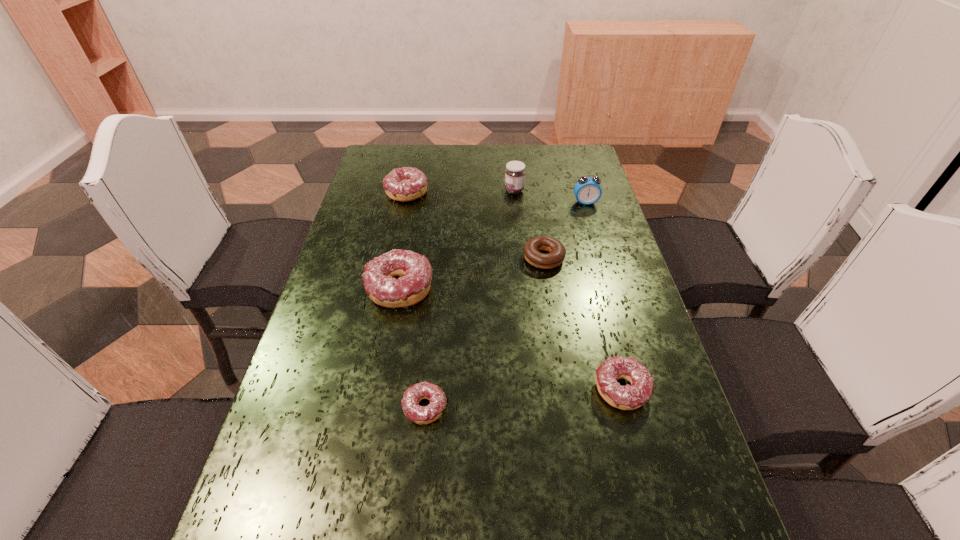
Locate which object ranks second in proximity to the jam. Please provide its 2D coordinates. Your answer should be formatted as a tuple, i.e. [(x, y)], where the tuple contains the x and y coordinates of a point satisfying the conditions above.

[(531, 249)]

Identify which doughnut is located as the third nearest to the brown doughnut. Please provide its 2D coordinates. Your answer should be formatted as a tuple, i.e. [(x, y)], where the tuple contains the x and y coordinates of a point satisfying the conditions above.

[(404, 184)]

I want to click on doughnut that is the fourth closest one to the fourth tallest object, so click(629, 397).

You are a GUI agent. You are given a task and a screenshot of the screen. Output one action in this format:
    pyautogui.click(x=<x>, y=<y>)
    Task: Click on the pink doughnut object that ranks as the third closest to the second tallest doughnut
    The height and width of the screenshot is (540, 960).
    Given the screenshot: What is the action you would take?
    click(629, 397)

This screenshot has height=540, width=960. I want to click on pink doughnut that is the closest one to the jam, so click(x=404, y=184).

The height and width of the screenshot is (540, 960). In order to click on free location that satisfies the following two spatial constraints: 1. on the front side of the third shortest doughnut; 2. on the right side of the second biggest pink doughnut in this screenshot , I will do `click(364, 390)`.

You are a GUI agent. You are given a task and a screenshot of the screen. Output one action in this format:
    pyautogui.click(x=<x>, y=<y>)
    Task: Click on the free space that satisfies the following two spatial constraints: 1. on the front side of the fifth shortest object; 2. on the left side of the smallest pink doughnut
    
    Given the screenshot: What is the action you would take?
    pyautogui.click(x=378, y=408)

You are a GUI agent. You are given a task and a screenshot of the screen. Output one action in this format:
    pyautogui.click(x=<x>, y=<y>)
    Task: Click on the free point that satisfies the following two spatial constraints: 1. on the front label of the jam; 2. on the front side of the biggest pink doughnut
    The image size is (960, 540).
    Given the screenshot: What is the action you would take?
    pyautogui.click(x=524, y=288)